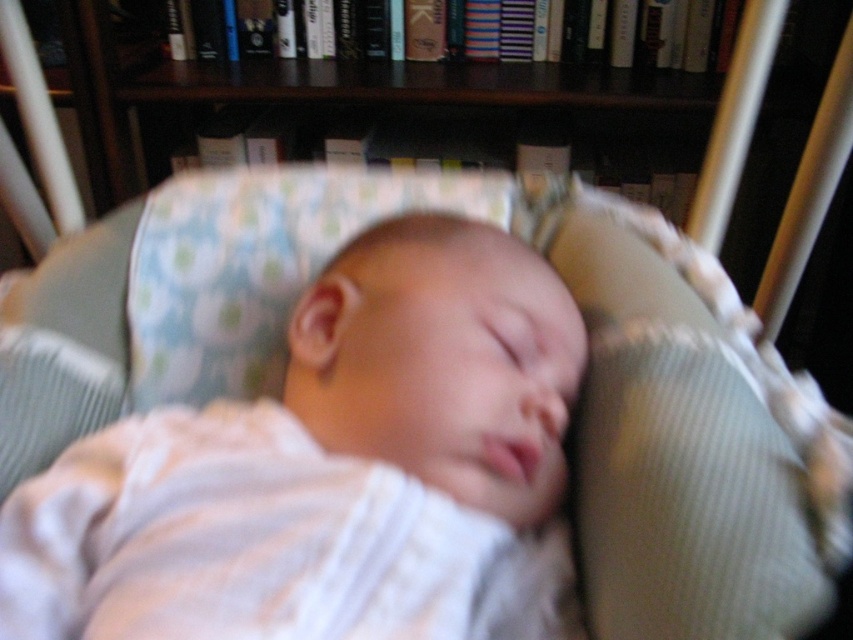
You are a parent checking on your baby. You see the white knit fabric baby at center and the green ribbed pillow at right. Which object is located above the other?

The green ribbed pillow at right is above the white knit fabric baby at center because the white knit fabric baby at center is positioned under it.

You are a photographer standing in front of the white knit fabric baby at center and want to capture a close portrait. Your camera has a minimum focusing distance of 16 inches. Can you take a clear photo without moving the baby?

The distance between you and the white knit fabric baby at center is 15.67 inches, which is less than the camera minimum focusing distance of 16 inches. Therefore, you cannot take a clear photo without moving the baby closer or farther away to meet the focusing requirement.